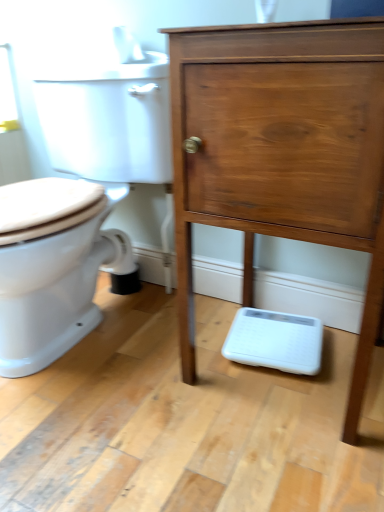
This screenshot has height=512, width=384. In order to click on vacant space underneath white glossy toilet at left (from a real-world perspective) in this screenshot , I will do `click(101, 327)`.